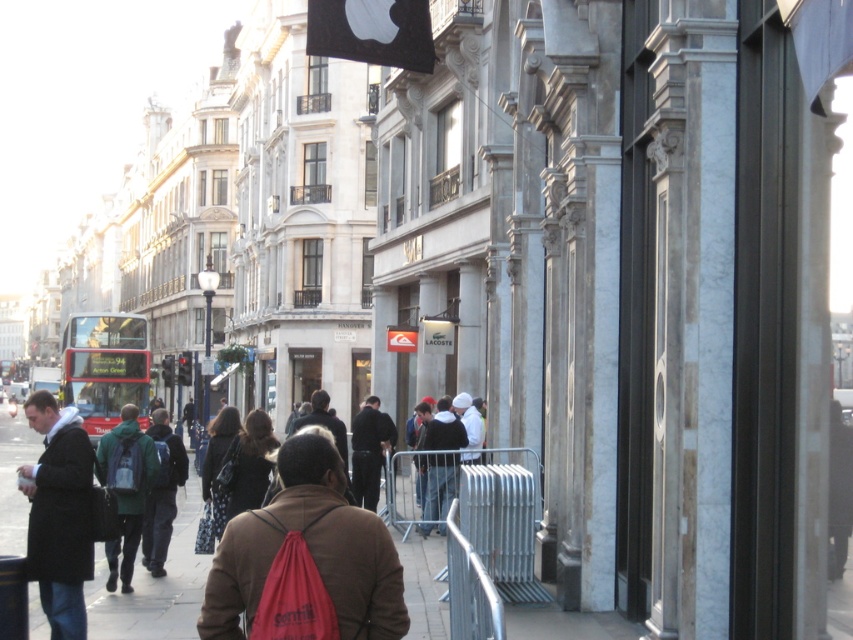
You are a pedestrian standing on the sidewalk looking towards the road. You see a dark brown leather coat at lower left and a red metallic bus at left. Which object is closer to you?

The dark brown leather coat at lower left is closer to you because it is positioned over the red metallic bus at left, indicating it is in front.

You are a delivery person trying to reach the green backpack at center on the sidewalk. There is a galvanized metal barrier at center in your way. Can you step over the barrier to reach the backpack?

The galvanized metal barrier at center is located above green backpack at center, so stepping over the barrier would allow you to reach the backpack since it is positioned above the backpack.

Looking at this image, you are a photographer standing on the sidewalk in this urban scene. You want to capture both the dark brown leather coat at lower left and the red metallic bus at left in a single shot. Considering their sizes, which object should you focus on to ensure both fit in the frame?

The dark brown leather coat at lower left is larger in width than the red metallic bus at left, so you should focus on the dark brown leather coat at lower left to ensure both fit in the frame.